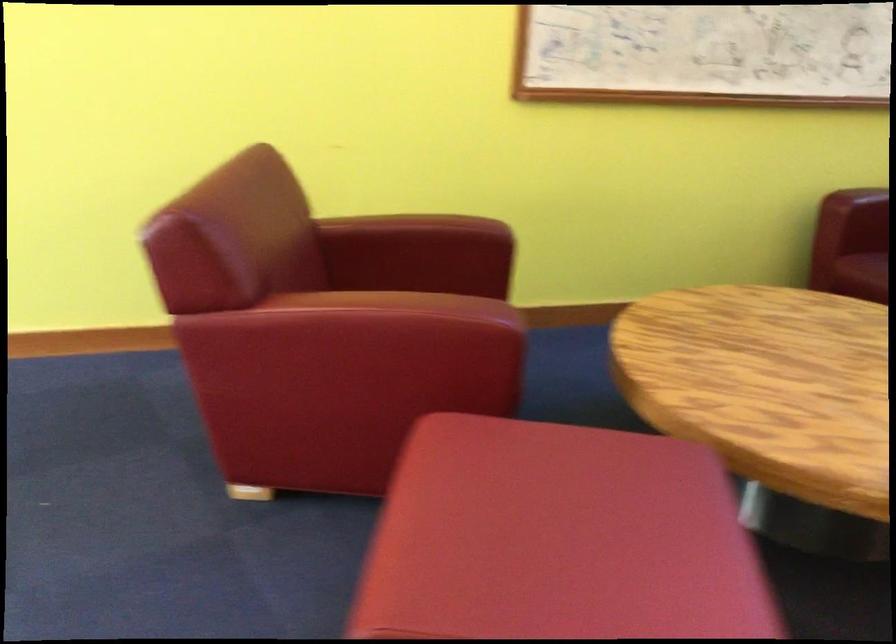
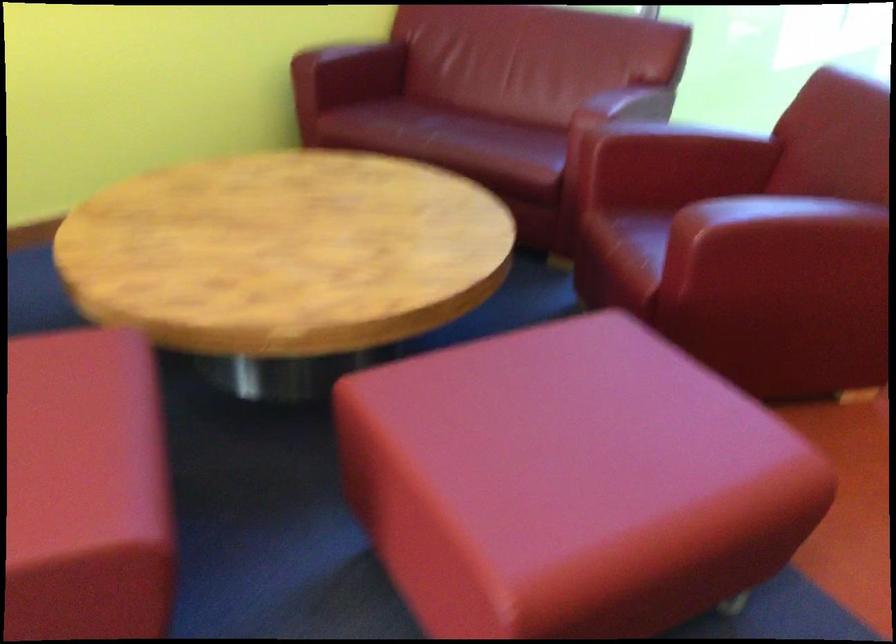
Question: How did the camera likely rotate?

Choices:
 (A) Left
 (B) Right
 (C) Up
 (D) Down

Answer: (B)